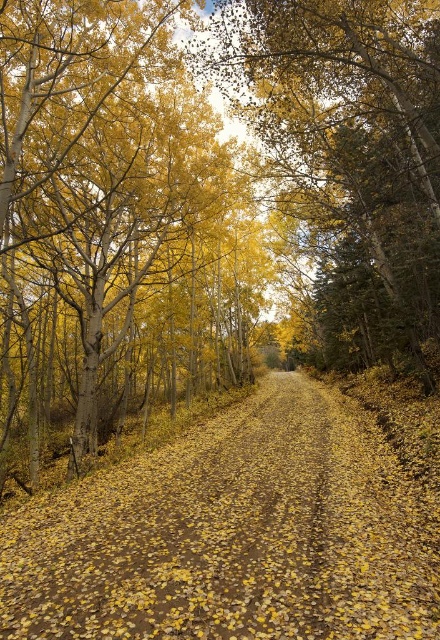
Does yellow leafy dirt path at center appear on the left side of golden textured leaves at center?

Yes, yellow leafy dirt path at center is to the left of golden textured leaves at center.

Does yellow leafy dirt path at center lie in front of golden textured leaves at center?

That is True.

This screenshot has height=640, width=440. Find the location of `yellow leafy dirt path at center`. yellow leafy dirt path at center is located at coordinates (231, 536).

Where is `yellow leafy dirt path at center`? This screenshot has height=640, width=440. yellow leafy dirt path at center is located at coordinates (231, 536).